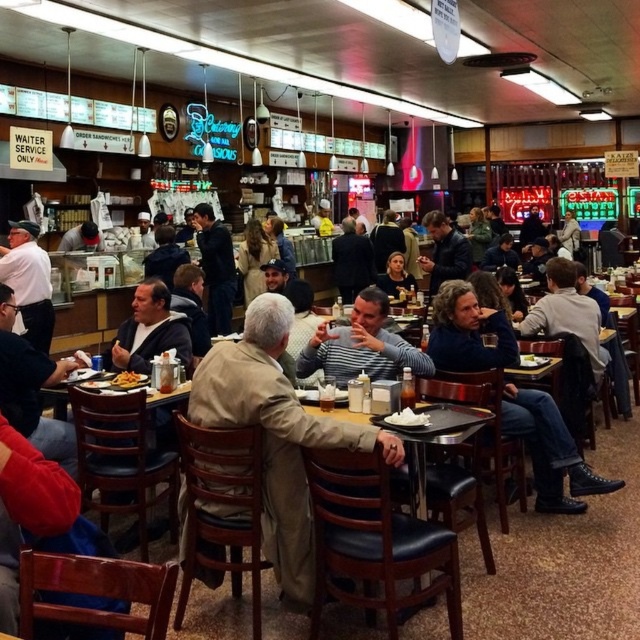
Question: Which is nearer to the golden crispy fries at center?

Choices:
 (A) striped long-sleeve shirt at center
 (B) white matte plate at center
 (C) yellow plastic tray at center

Answer: (A)

Question: Can you confirm if striped long-sleeve shirt at center is bigger than khaki cotton jacket at center?

Choices:
 (A) no
 (B) yes

Answer: (A)

Question: Which of these objects is positioned closest to the khaki cotton jacket at center?

Choices:
 (A) black plastic tray at center
 (B) white matte plate at center

Answer: (A)

Question: Does black plastic tray at center have a smaller size compared to golden crispy fries at center?

Choices:
 (A) yes
 (B) no

Answer: (B)

Question: Which point is farther to the camera?

Choices:
 (A) coord(420,400)
 (B) coord(525,355)

Answer: (B)

Question: Can you confirm if black plastic tray at center is positioned to the left of white matte plate at center?

Choices:
 (A) yes
 (B) no

Answer: (B)